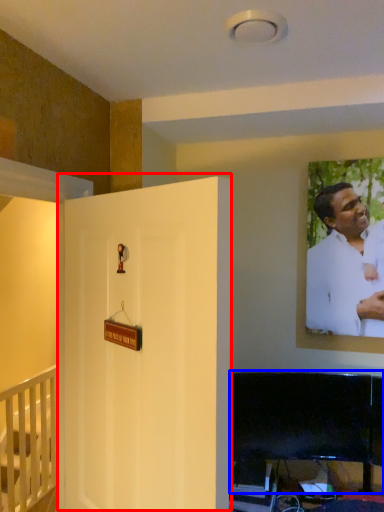
Question: Which object appears farthest to the camera in this image, door (highlighted by a red box) or furniture (highlighted by a blue box)?

Choices:
 (A) door
 (B) furniture

Answer: (B)